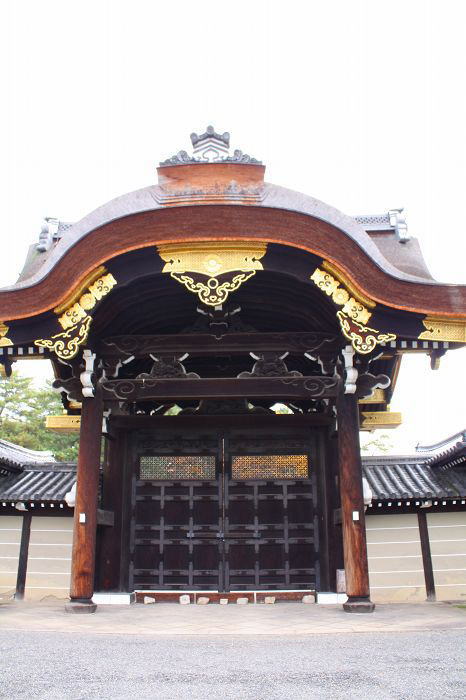
This screenshot has height=700, width=466. What are the coordinates of `wood column` in the screenshot? It's located at (83, 477), (349, 540).